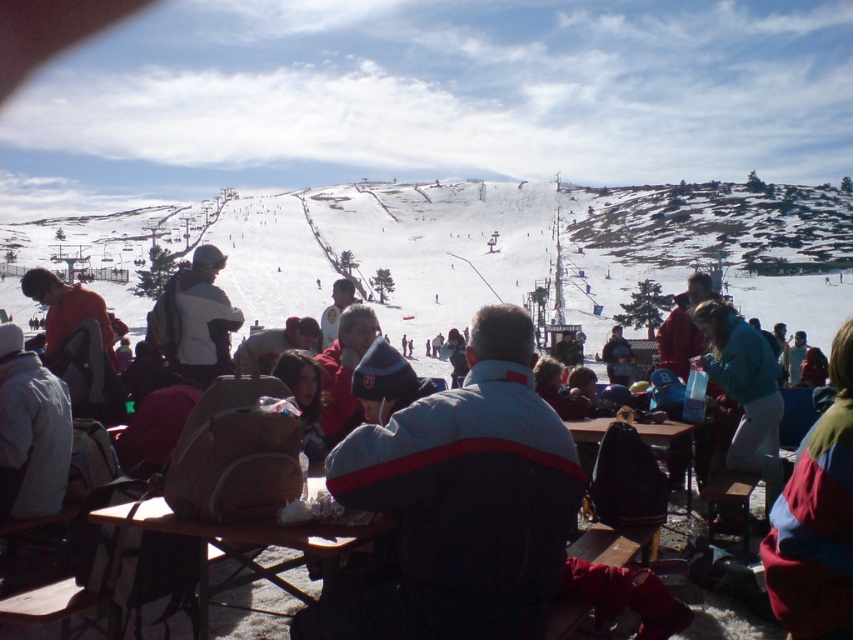
You are packing for a day trip to the ski resort and have a small bag that can only hold items narrower than the white fleece jacket at center. Can you fit the matte gray backpack at center into your bag?

The white fleece jacket at center is narrower than the matte gray backpack at center, so the matte gray backpack at center is wider and cannot fit into the bag designed for items narrower than the white fleece jacket at center.

You are a photographer trying to capture both the multicolored fabric jacket at lower right and the white fleece jacket at center in a single shot. Which jacket will appear bigger in the photo?

The multicolored fabric jacket at lower right will appear bigger in the photo because it has a larger size compared to the white fleece jacket at center.

You are standing at the ski resort and want to take a photo of the two points mentioned. Which point, point (821, 515) or point (170, 296), is closer to you and should be framed first in your shot?

Point (821, 515) is closer to the viewer than point (170, 296), so it should be framed first in your shot.